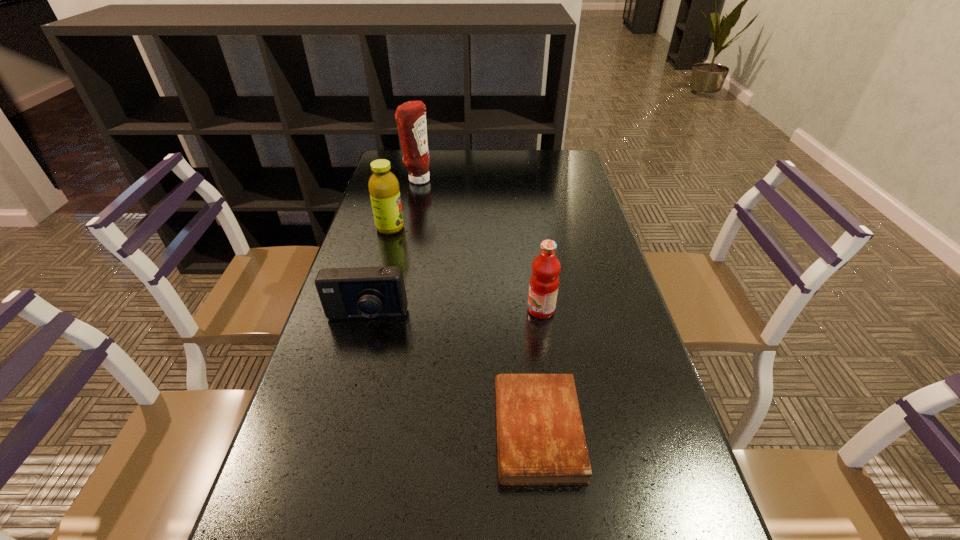
What are the coordinates of `vacant area situated 0.050m on the front label of the right fruit juice` in the screenshot? It's located at (507, 310).

I want to click on free spot located 0.240m on the front label of the right fruit juice, so click(430, 310).

You are a GUI agent. You are given a task and a screenshot of the screen. Output one action in this format:
    pyautogui.click(x=<x>, y=<y>)
    Task: Click on the free location located on the front label of the right fruit juice
    The height and width of the screenshot is (540, 960).
    Given the screenshot: What is the action you would take?
    pyautogui.click(x=491, y=310)

Find the location of a particular element. free space located 0.130m on the front-facing side of the second shortest object is located at coordinates (350, 376).

Identify the location of vacant area situated 0.310m on the spine side of the nearest object. The image size is (960, 540). (335, 430).

Locate an element on the screen. The image size is (960, 540). vacant space located on the spine side of the nearest object is located at coordinates (397, 430).

You are a GUI agent. You are given a task and a screenshot of the screen. Output one action in this format:
    pyautogui.click(x=<x>, y=<y>)
    Task: Click on the vacant point located on the spine side of the nearest object
    The width and height of the screenshot is (960, 540).
    Given the screenshot: What is the action you would take?
    pyautogui.click(x=382, y=430)

Image resolution: width=960 pixels, height=540 pixels. I want to click on object situated at the far edge, so click(411, 116).

You are a GUI agent. You are given a task and a screenshot of the screen. Output one action in this format:
    pyautogui.click(x=<x>, y=<y>)
    Task: Click on the condiment that is at the left edge
    
    Given the screenshot: What is the action you would take?
    pyautogui.click(x=411, y=116)

Find the location of `fruit juice at the left edge`. fruit juice at the left edge is located at coordinates (383, 185).